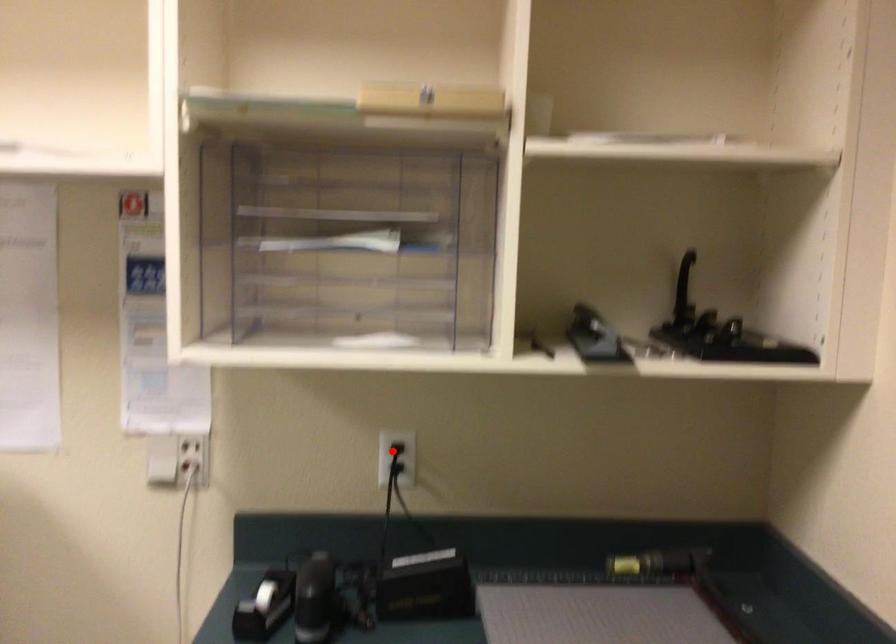
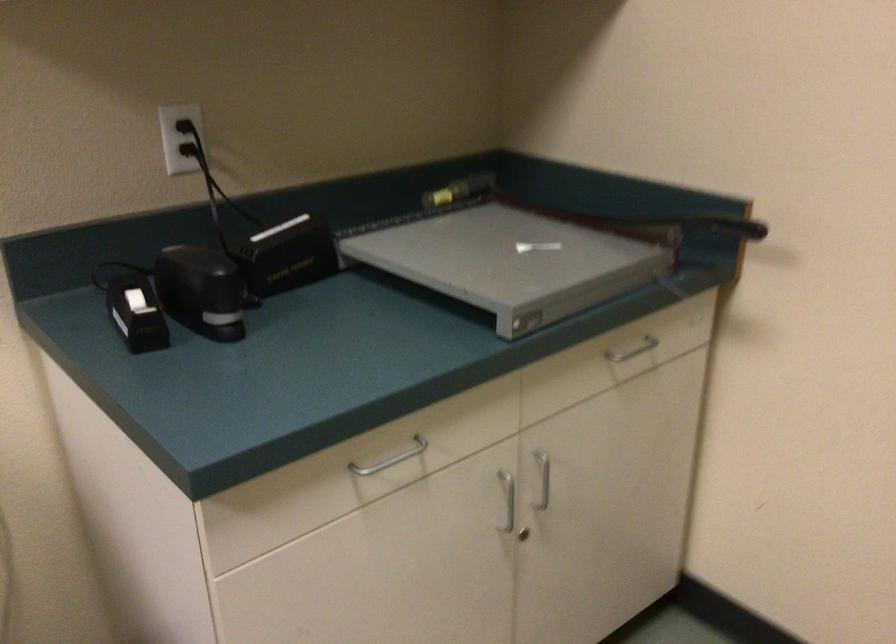
In the second image, find the point that corresponds to the highlighted location in the first image.

(186, 128)